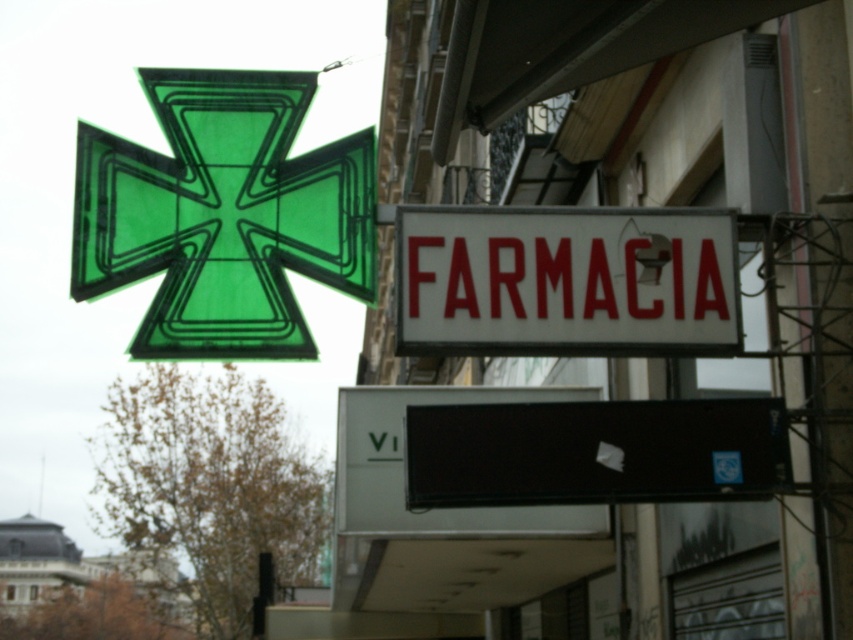
From the picture: Between green matte cross at upper left and white matte signboard at center, which one has less height?

white matte signboard at center

Where is `green matte cross at upper left`? green matte cross at upper left is located at coordinates (223, 214).